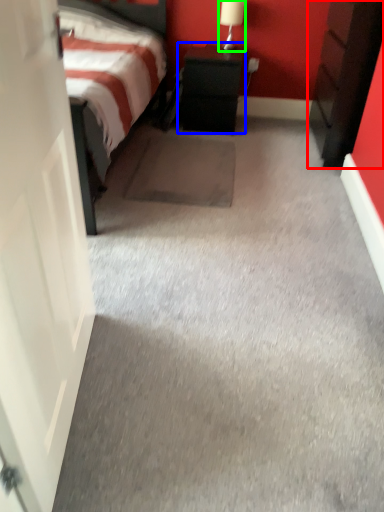
Question: Which is nearer to the nightstand (highlighted by a red box)? nightstand (highlighted by a blue box) or table lamp (highlighted by a green box).

Choices:
 (A) nightstand
 (B) table lamp

Answer: (A)